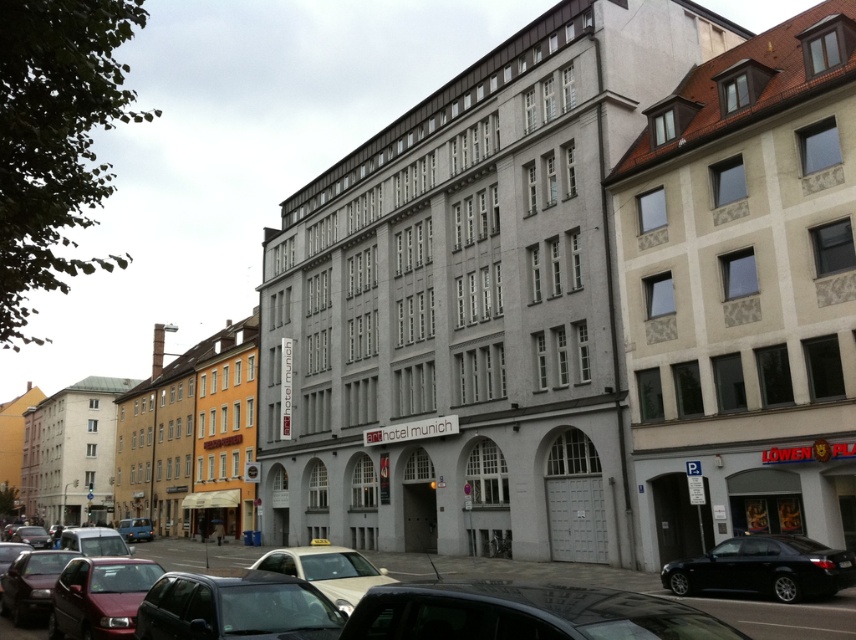
Is point (587, 602) farther from camera compared to point (128, 532)?

No, (587, 602) is closer to viewer.

Where is `shiny black car at lower center`? This screenshot has width=856, height=640. shiny black car at lower center is located at coordinates (524, 612).

What do you see at coordinates (524, 612) in the screenshot?
I see `shiny black car at lower center` at bounding box center [524, 612].

You are a GUI agent. You are given a task and a screenshot of the screen. Output one action in this format:
    pyautogui.click(x=<x>, y=<y>)
    Task: Click on the shiny black car at lower center
    Image resolution: width=856 pixels, height=640 pixels.
    Given the screenshot: What is the action you would take?
    pyautogui.click(x=524, y=612)

Looking at this image, can you confirm if matte black car at lower left is positioned below beige matte car at center?

No.

Is matte black car at lower left smaller than beige matte car at center?

Correct, matte black car at lower left occupies less space than beige matte car at center.

This screenshot has width=856, height=640. I want to click on matte black car at lower left, so click(235, 608).

Locate an element on the screen. The image size is (856, 640). matte black car at lower left is located at coordinates (235, 608).

Who is higher up, shiny black car at lower center or beige matte car at center?

shiny black car at lower center

Between shiny black car at lower center and beige matte car at center, which one appears on the left side from the viewer's perspective?

beige matte car at center is more to the left.

This screenshot has width=856, height=640. Find the location of `shiny black car at lower center`. shiny black car at lower center is located at coordinates (524, 612).